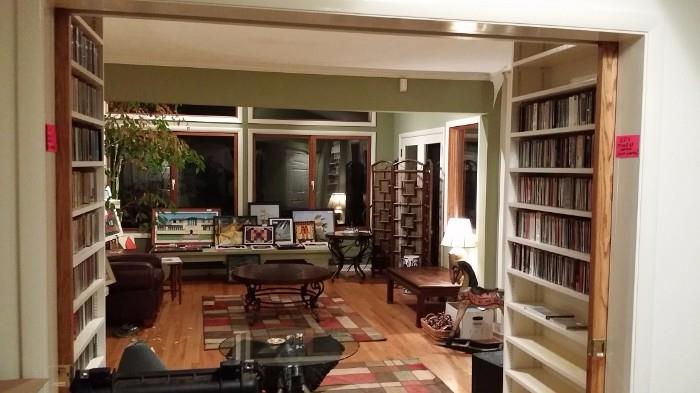
The width and height of the screenshot is (700, 393). Identify the location of coloured rug. (337, 321).